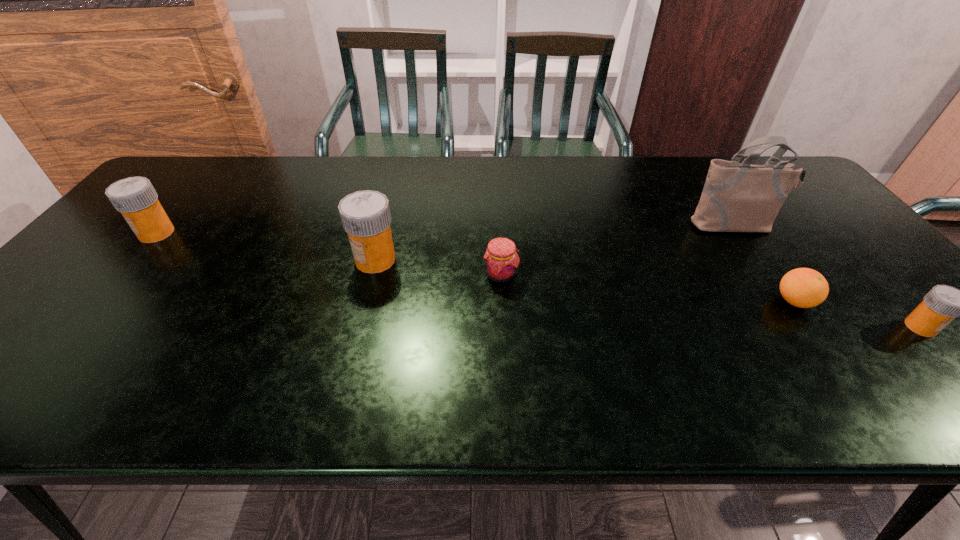
I want to click on medicine that is the closest to the second nearest medicine, so click(x=135, y=197).

Where is `free space that satisfies the following two spatial constraints: 1. on the front-facing side of the tallest object; 2. on the label side of the second shortest medicine`? The width and height of the screenshot is (960, 540). free space that satisfies the following two spatial constraints: 1. on the front-facing side of the tallest object; 2. on the label side of the second shortest medicine is located at coordinates (739, 233).

I want to click on vacant space that satisfies the following two spatial constraints: 1. on the front-facing side of the orange; 2. on the left side of the shoulder bag, so click(785, 301).

You are a GUI agent. You are given a task and a screenshot of the screen. Output one action in this format:
    pyautogui.click(x=<x>, y=<y>)
    Task: Click on the vacant area that satisfies the following two spatial constraints: 1. on the front-facing side of the orange; 2. on the left side of the tallest object
    
    Given the screenshot: What is the action you would take?
    pyautogui.click(x=785, y=301)

Image resolution: width=960 pixels, height=540 pixels. In order to click on vacant space that satisfies the following two spatial constraints: 1. on the front-facing side of the tallest object; 2. on the label side of the second shortest medicine in this screenshot , I will do `click(739, 233)`.

I want to click on free space that satisfies the following two spatial constraints: 1. on the front-facing side of the shoulder bag; 2. on the right side of the orange, so click(x=785, y=301).

In order to click on vacant space that satisfies the following two spatial constraints: 1. on the front-facing side of the shoulder bag; 2. on the label side of the second medicine from left to right in this screenshot , I will do `click(757, 260)`.